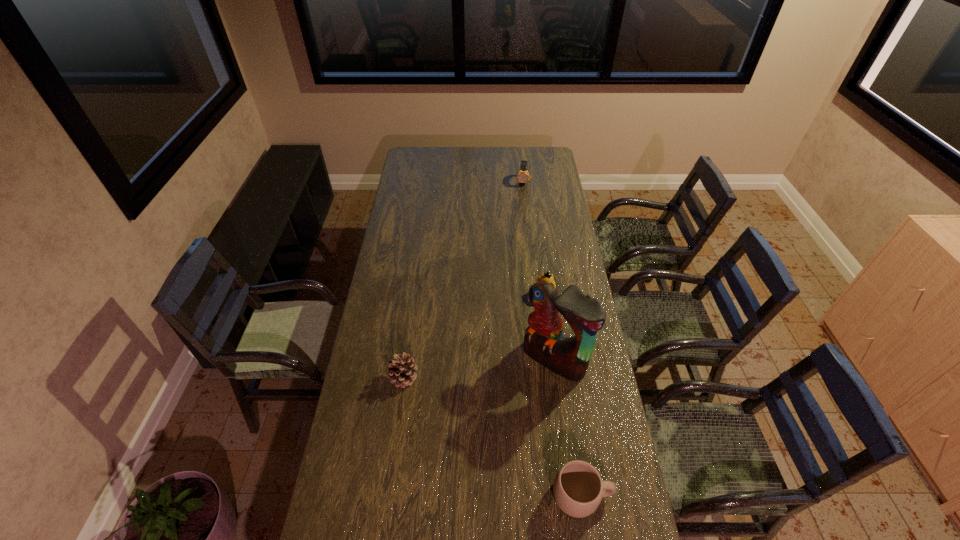
This screenshot has width=960, height=540. What are the coordinates of `object present at the near right corner` in the screenshot? It's located at (578, 489).

At what (x,y) coordinates should I click in order to perform the action: click on vacant space at the far edge of the desktop. Please return your answer as a coordinate pair (x, y). Looking at the image, I should click on (454, 158).

Identify the location of vacant space at the left edge. This screenshot has width=960, height=540. (404, 220).

Where is `free spot at the right edge of the desktop`? free spot at the right edge of the desktop is located at coordinates (559, 272).

Find the location of a particular element. free space at the far left corner of the desktop is located at coordinates (405, 155).

The width and height of the screenshot is (960, 540). Find the location of `vacant space at the far right corner`. vacant space at the far right corner is located at coordinates (547, 150).

Identify the location of free space at the near right corner of the desktop. (610, 510).

The height and width of the screenshot is (540, 960). Identify the location of unoccupied area between the mug and the tallest object. (567, 427).

Find the location of `free space between the leftmost object and the mug`. free space between the leftmost object and the mug is located at coordinates (492, 436).

What are the coordinates of `unoccupied area between the parrot and the pinecone` in the screenshot? It's located at (479, 368).